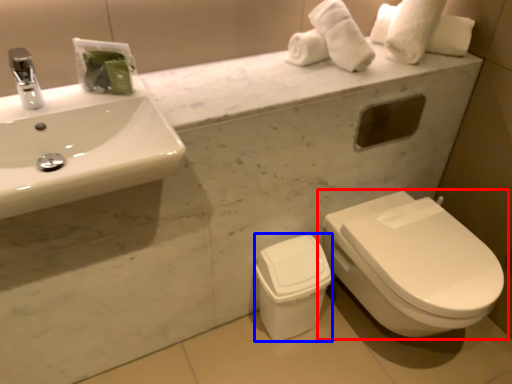
Question: Which point is further to the camera, toilet (highlighted by a red box) or porcelain (highlighted by a blue box)?

Choices:
 (A) toilet
 (B) porcelain

Answer: (B)